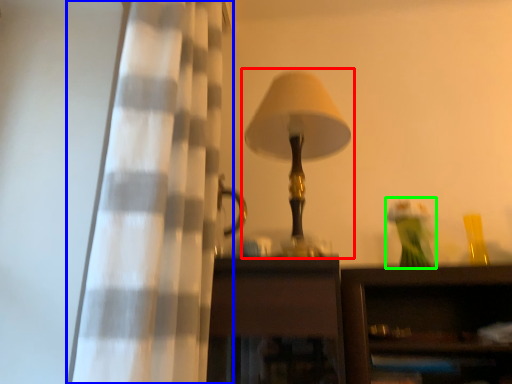
Question: Which object is positioned farthest from lamp (highlighted by a red box)? Select from curtain (highlighted by a blue box) and toy (highlighted by a green box).

Choices:
 (A) curtain
 (B) toy

Answer: (B)